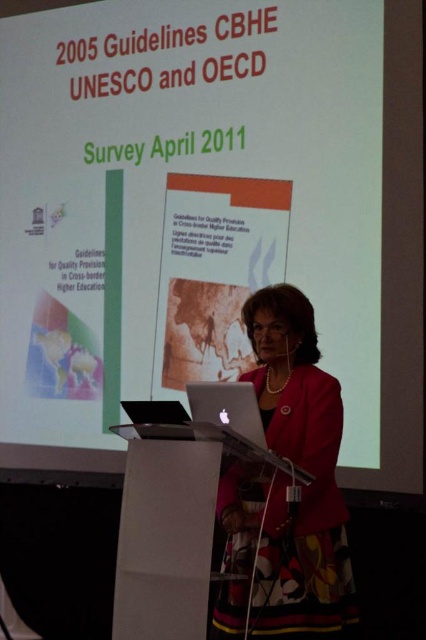
You are an attendee at the presentation and need to take notes. The speaker is wearing a matte black blazer at center and has a silver metallic laptop at center. Which object is closer to you, the attendee?

The matte black blazer at center is closer to you, the attendee, because it is further to the viewer than the silver metallic laptop at center, meaning it appears nearer in the image.

You are standing at the point labeled point (328, 426) in the presentation room. The camera is positioned somewhere in the room. If you want to move closer to the camera, which direction should you move?

The point labeled point (328, 426) is 2.36 meters away from the camera. To move closer to the camera, you should move in the direction towards the camera, reducing the distance from 2.36 meters to a desired proximity.